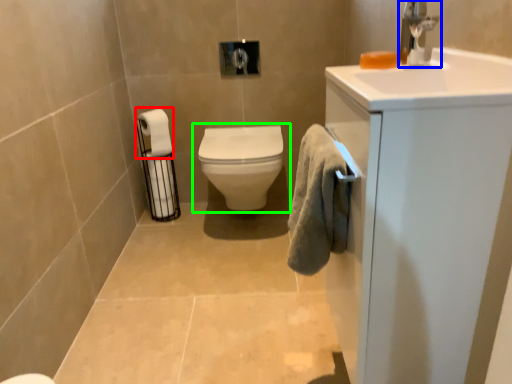
Question: Based on their relative distances, which object is nearer to toilet paper (highlighted by a red box)? Choose from tap (highlighted by a blue box) and toilet (highlighted by a green box).

Choices:
 (A) tap
 (B) toilet

Answer: (B)